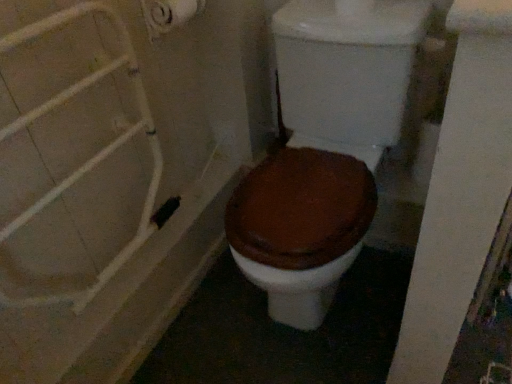
Question: From their relative heights in the image, would you say brown matte toilet at center is taller or shorter than white matte shower door at left?

Choices:
 (A) tall
 (B) short

Answer: (A)

Question: Would you say brown matte toilet at center is to the left or to the right of white matte shower door at left in the picture?

Choices:
 (A) left
 (B) right

Answer: (B)

Question: Estimate the real-world distances between objects in this image. Which object is closer to the white matte shower door at left?

Choices:
 (A) brown matte toilet at center
 (B) white matte toilet paper at upper left

Answer: (B)

Question: Which object is positioned farthest from the brown matte toilet at center?

Choices:
 (A) white matte toilet paper at upper left
 (B) white matte shower door at left

Answer: (A)